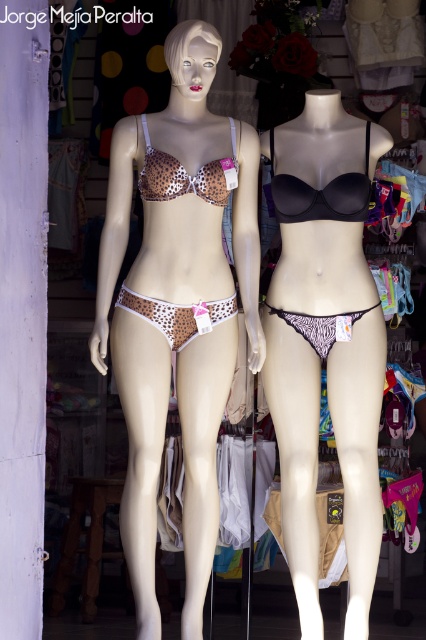
Question: Observing the image, what is the correct spatial positioning of matte black bikini at center in reference to leopard print fabric bikini at center?

Choices:
 (A) right
 (B) left

Answer: (A)

Question: Which object is positioned closest to the leopard print fabric bikini at left?

Choices:
 (A) matte black bikini at center
 (B) leopard print fabric bikini at center

Answer: (A)

Question: Among these objects, which one is nearest to the camera?

Choices:
 (A) leopard print fabric bikini top at center
 (B) matte black bikini at center
 (C) leopard print fabric bikini at left

Answer: (C)

Question: Does matte black bikini at center appear over leopard print fabric bikini at center?

Choices:
 (A) yes
 (B) no

Answer: (B)

Question: Among these objects, which one is nearest to the camera?

Choices:
 (A) leopard print fabric bikini at center
 (B) leopard print fabric bikini at left
 (C) matte black bikini at center
 (D) leopard print fabric bikini top at center

Answer: (B)

Question: Can you confirm if leopard print fabric bikini at center is wider than leopard print fabric bikini top at center?

Choices:
 (A) yes
 (B) no

Answer: (B)